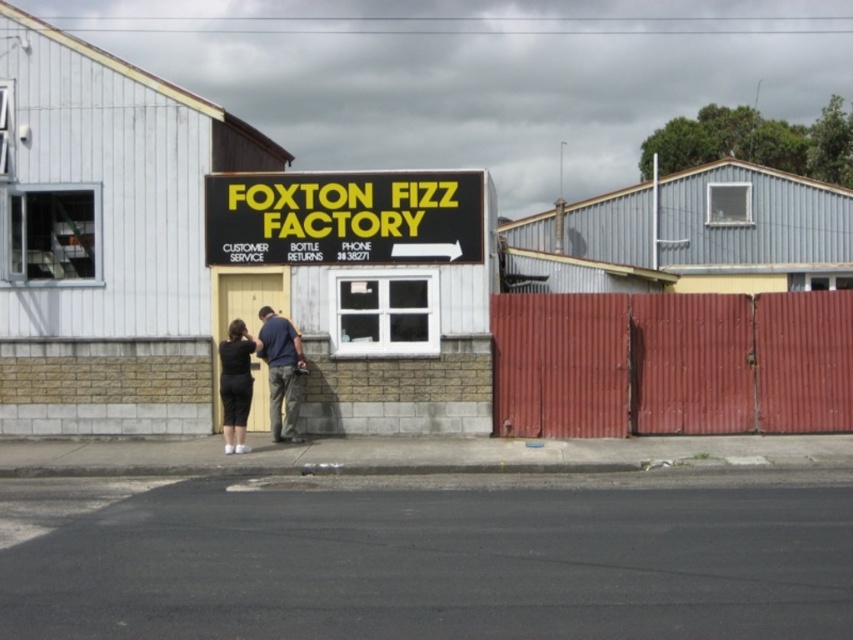
Question: Can you confirm if black plastic sign at center is positioned above black matte dress at lower center?

Choices:
 (A) no
 (B) yes

Answer: (B)

Question: Which point is closer to the camera?

Choices:
 (A) (207, 250)
 (B) (242, 376)
 (C) (384, 179)
 (D) (289, 406)

Answer: (B)

Question: Considering the real-world distances, which object is closest to the dark blue shirt at center?

Choices:
 (A) black matte sign at center
 (B) black plastic sign at center

Answer: (A)

Question: Is black matte sign at center positioned in front of dark blue shirt at center?

Choices:
 (A) no
 (B) yes

Answer: (A)

Question: Among these objects, which one is farthest from the camera?

Choices:
 (A) black matte sign at center
 (B) black plastic sign at center

Answer: (A)

Question: Can you confirm if black plastic sign at center is positioned to the right of black matte dress at lower center?

Choices:
 (A) no
 (B) yes

Answer: (B)